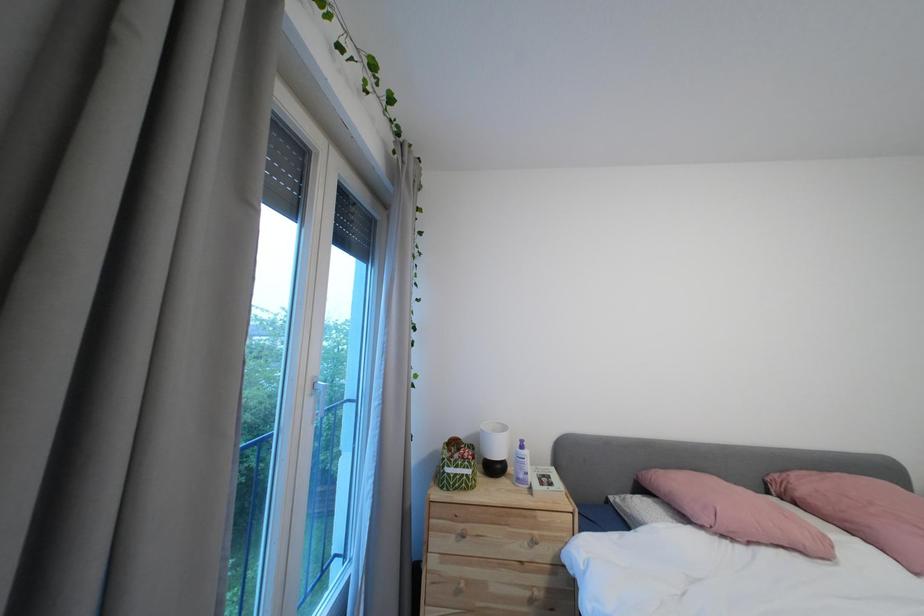
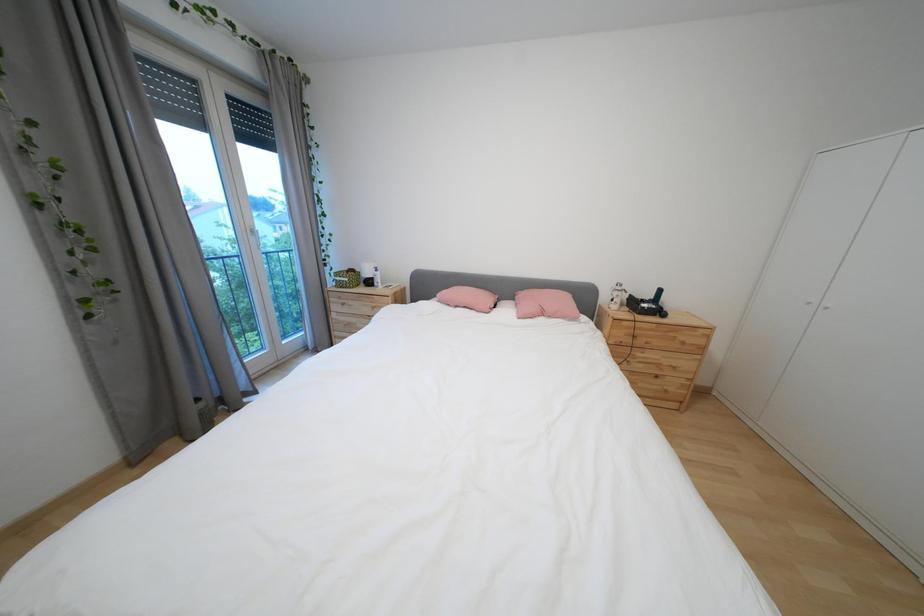
The images are taken continuously from a first-person perspective. In which direction are you moving?

The cameraman moved toward right, backward.